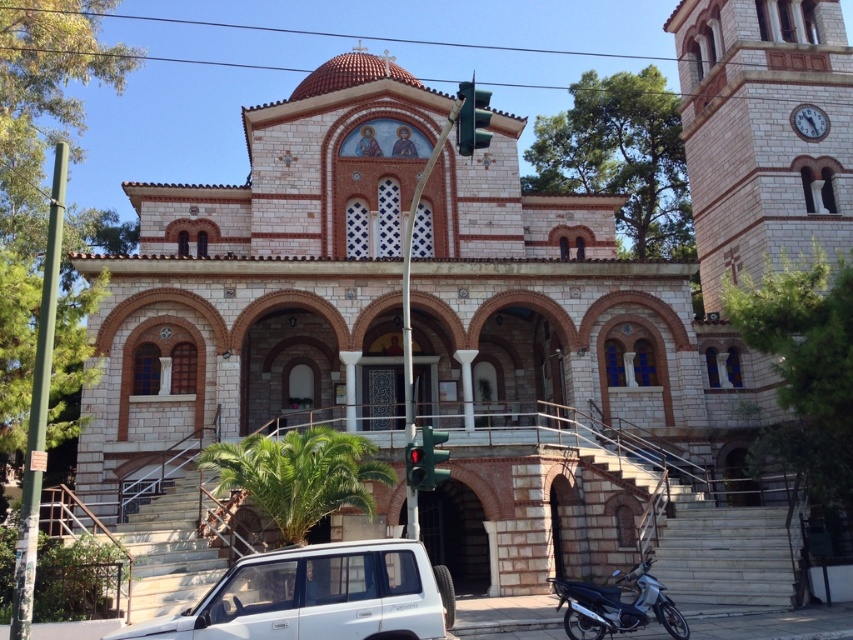
Question: Does white matte suv at lower center have a larger size compared to green glass traffic light at center?

Choices:
 (A) no
 (B) yes

Answer: (A)

Question: Is silver metallic motorcycle at lower right wider than green glass traffic light at center?

Choices:
 (A) yes
 (B) no

Answer: (A)

Question: Based on their relative distances, which object is nearer to the silver metallic motorcycle at lower right?

Choices:
 (A) green glass traffic light at center
 (B) white matte suv at lower center

Answer: (B)

Question: Which of the following is the farthest from the observer?

Choices:
 (A) (445, 595)
 (B) (483, 120)

Answer: (A)

Question: Which of the following is the farthest from the observer?

Choices:
 (A) green glass traffic light at center
 (B) silver metallic motorcycle at lower right
 (C) white matte suv at lower center

Answer: (B)

Question: Where is silver metallic motorcycle at lower right located in relation to green glass traffic light at center in the image?

Choices:
 (A) left
 (B) right

Answer: (B)